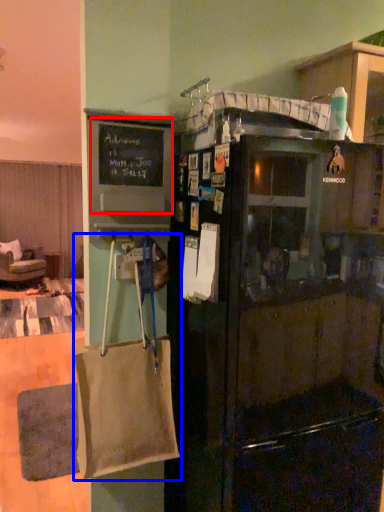
Question: Which of the following is the farthest to the observer, bulletin board (highlighted by a red box) or grocery bag (highlighted by a blue box)?

Choices:
 (A) bulletin board
 (B) grocery bag

Answer: (A)